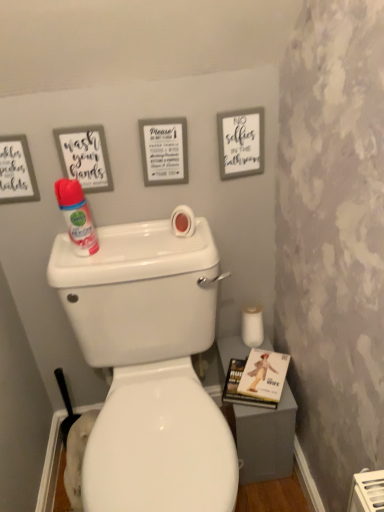
The height and width of the screenshot is (512, 384). I want to click on vacant space in front of pink matte toilet paper at upper center, arranged as the 1th toilet paper when viewed from the top, so click(182, 251).